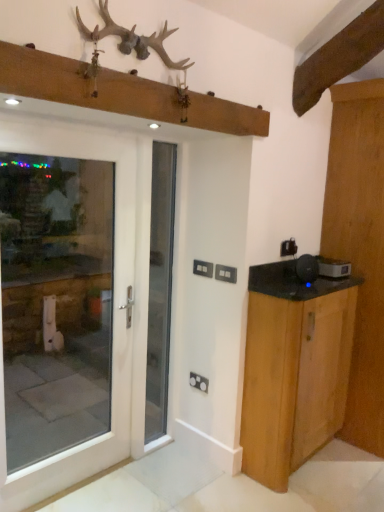
This screenshot has width=384, height=512. Identify the location of free spot above light wood cabinet at right (from a real-world perspective). click(314, 283).